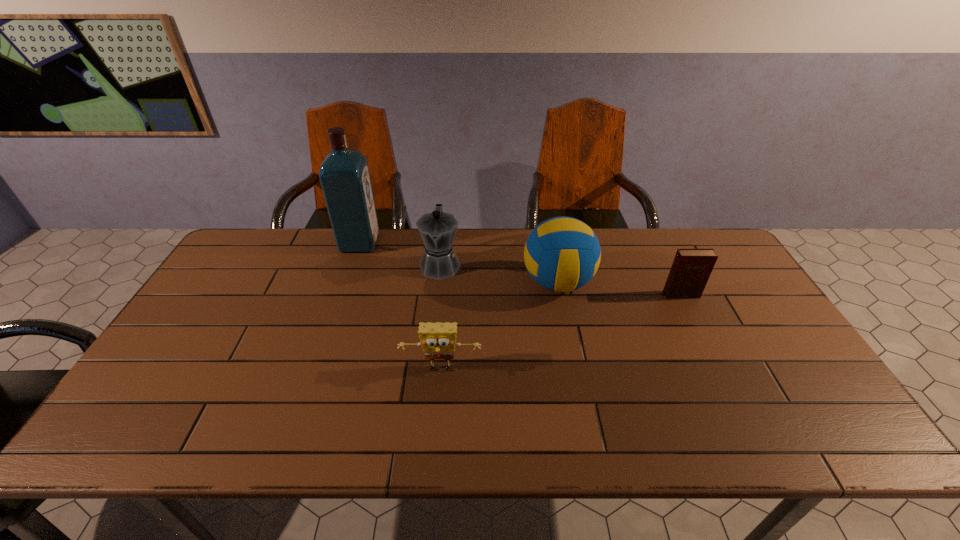
In order to click on free point between the diary and the tallest object in this screenshot , I will do `click(520, 269)`.

Find the location of a particular element. The width and height of the screenshot is (960, 540). free space between the fourth object from left to right and the coffeepot is located at coordinates (499, 273).

What are the coordinates of `vacant area that lies between the coffeepot and the second object from right to left` in the screenshot? It's located at (499, 273).

What are the coordinates of `free spot between the nearest object and the leftmost object` in the screenshot? It's located at (400, 307).

The width and height of the screenshot is (960, 540). Identify the location of vacant region between the coffeepot and the tallest object. (400, 254).

What are the coordinates of `vacant point located between the tallest object and the coffeepot` in the screenshot? It's located at (400, 254).

Where is `the fourth closest object to the rightmost object`? The image size is (960, 540). the fourth closest object to the rightmost object is located at coordinates (344, 175).

The height and width of the screenshot is (540, 960). I want to click on object that is the second closest to the volleyball, so [x=691, y=269].

Identify the location of free space that satisfies the following two spatial constraints: 1. on the flat label side of the leftmost object; 2. on the right side of the volleyball. The image size is (960, 540). (347, 282).

Identify the location of vacant region that satisfies the following two spatial constraints: 1. on the flat label side of the tallest object; 2. on the right side of the volleyball. The height and width of the screenshot is (540, 960). (x=347, y=282).